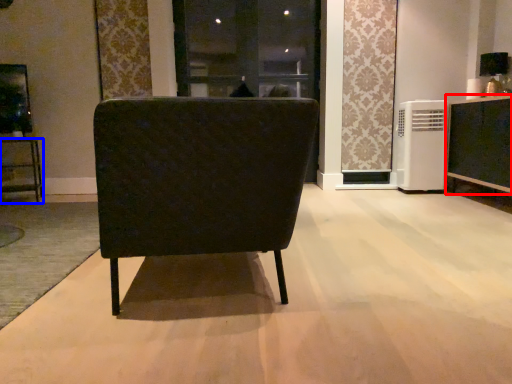
Question: Which object is closer to the camera taking this photo, cabinetry (highlighted by a red box) or furniture (highlighted by a blue box)?

Choices:
 (A) cabinetry
 (B) furniture

Answer: (A)